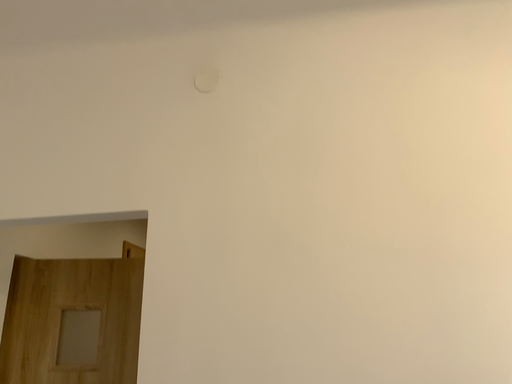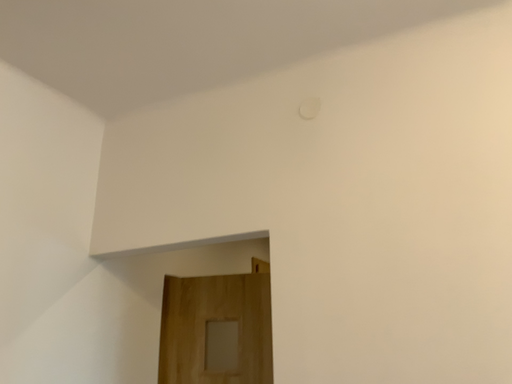
Question: Which way did the camera rotate in the video?

Choices:
 (A) rotated right
 (B) rotated left

Answer: (B)